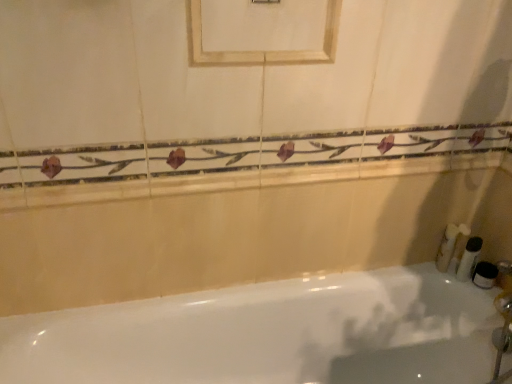
Question: Does white fluffy sponge at right, which is counted as the first toiletry, starting from the left, come in front of white matte toothbrushes at right, which is the third toiletry from right to left?

Choices:
 (A) yes
 (B) no

Answer: (A)

Question: From a real-world perspective, is white fluffy sponge at right, arranged as the 4th toiletry when viewed from the right, below white matte toothbrushes at right, which is the third toiletry from right to left?

Choices:
 (A) yes
 (B) no

Answer: (B)

Question: Can white matte toothbrushes at right, which is the 2th toiletry in left-to-right order, be found inside white fluffy sponge at right, which is counted as the first toiletry, starting from the left?

Choices:
 (A) no
 (B) yes

Answer: (A)

Question: Is white fluffy sponge at right, arranged as the 4th toiletry when viewed from the right, beside white matte toothbrushes at right, which is the 2th toiletry in left-to-right order?

Choices:
 (A) no
 (B) yes

Answer: (B)

Question: Does white fluffy sponge at right, which is counted as the first toiletry, starting from the left, have a larger size compared to white matte toothbrushes at right, which is the 2th toiletry in left-to-right order?

Choices:
 (A) no
 (B) yes

Answer: (B)

Question: In terms of height, does white matte jar at right, the fourth toiletry from the left, look taller or shorter compared to porcelain tile balustrade at upper center?

Choices:
 (A) short
 (B) tall

Answer: (B)

Question: Is white matte jar at right, which is the first toiletry from right to left, spatially inside porcelain tile balustrade at upper center, or outside of it?

Choices:
 (A) inside
 (B) outside

Answer: (B)

Question: In terms of size, does white matte jar at right, which is the first toiletry from right to left, appear bigger or smaller than porcelain tile balustrade at upper center?

Choices:
 (A) big
 (B) small

Answer: (B)

Question: Looking at their shapes, would you say white matte jar at right, which is the first toiletry from right to left, is wider or thinner than porcelain tile balustrade at upper center?

Choices:
 (A) wide
 (B) thin

Answer: (A)

Question: Visually, is porcelain tile balustrade at upper center positioned to the left or to the right of white fluffy sponge at right, which is counted as the first toiletry, starting from the left?

Choices:
 (A) left
 (B) right

Answer: (A)

Question: Is point (223, 175) closer or farther from the camera than point (452, 225)?

Choices:
 (A) farther
 (B) closer

Answer: (B)

Question: From the image's perspective, is porcelain tile balustrade at upper center above or below white fluffy sponge at right, which is counted as the first toiletry, starting from the left?

Choices:
 (A) below
 (B) above

Answer: (B)

Question: Is porcelain tile balustrade at upper center in front of or behind white fluffy sponge at right, arranged as the 4th toiletry when viewed from the right, in the image?

Choices:
 (A) front
 (B) behind

Answer: (A)

Question: From their relative heights in the image, would you say white matte toothbrushes at right, which is the third toiletry from right to left, is taller or shorter than white glossy bathtub at lower center?

Choices:
 (A) tall
 (B) short

Answer: (B)

Question: Considering the positions of point (464, 233) and point (225, 375), is point (464, 233) closer or farther from the camera than point (225, 375)?

Choices:
 (A) closer
 (B) farther

Answer: (B)